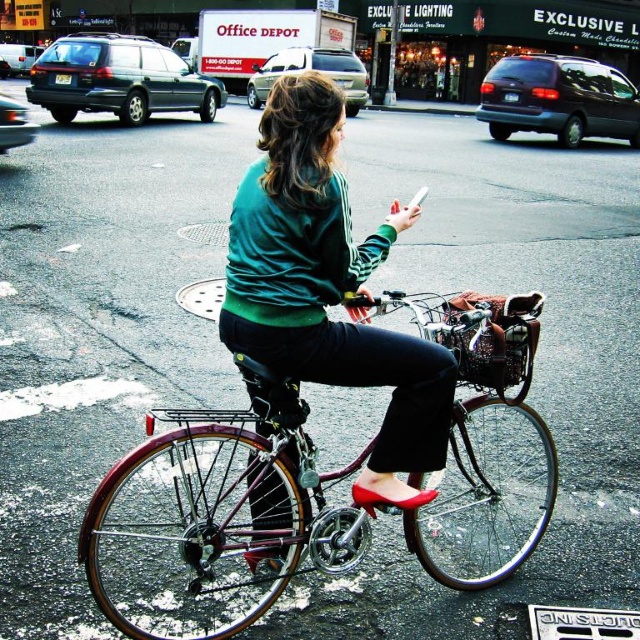
Does shiny metallic bicycle at center have a lesser width compared to green matte sweater at center?

No.

Is point (132, 490) positioned before point (275, 93)?

No, (132, 490) is further to viewer.

You are a GUI agent. You are given a task and a screenshot of the screen. Output one action in this format:
    pyautogui.click(x=<x>, y=<y>)
    Task: Click on the shiny metallic bicycle at center
    This screenshot has width=640, height=640.
    Given the screenshot: What is the action you would take?
    pyautogui.click(x=212, y=516)

Is point (364, 371) farther from viewer compared to point (416, 196)?

No, it is in front of (416, 196).

Based on the photo, can you confirm if green matte sweater at center is positioned to the right of white plastic smartphone at center?

No, green matte sweater at center is not to the right of white plastic smartphone at center.

Who is more forward, [369,483] or [413,198]?

Point [369,483] is in front.

Where is `green matte sweater at center`? This screenshot has width=640, height=640. green matte sweater at center is located at coordinates (326, 289).

Who is more distant from viewer, [307,228] or [497,364]?

Point [497,364]

Is green matte sweater at center thinner than metallic silver basket at center?

Incorrect, green matte sweater at center's width is not less than metallic silver basket at center's.

Which is behind, point (308, 259) or point (513, 372)?

The point (513, 372) is behind.

What are the coordinates of `green matte sweater at center` in the screenshot? It's located at (326, 289).